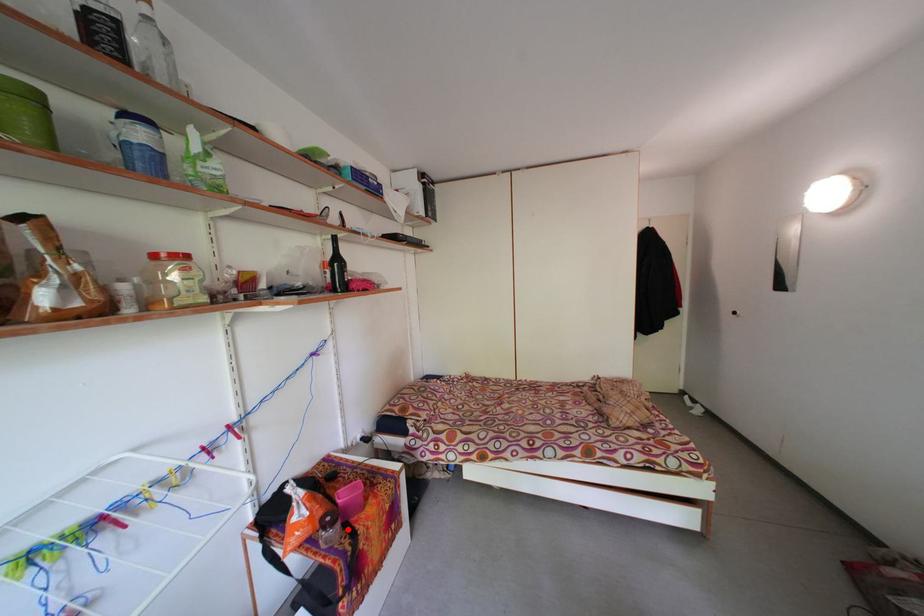
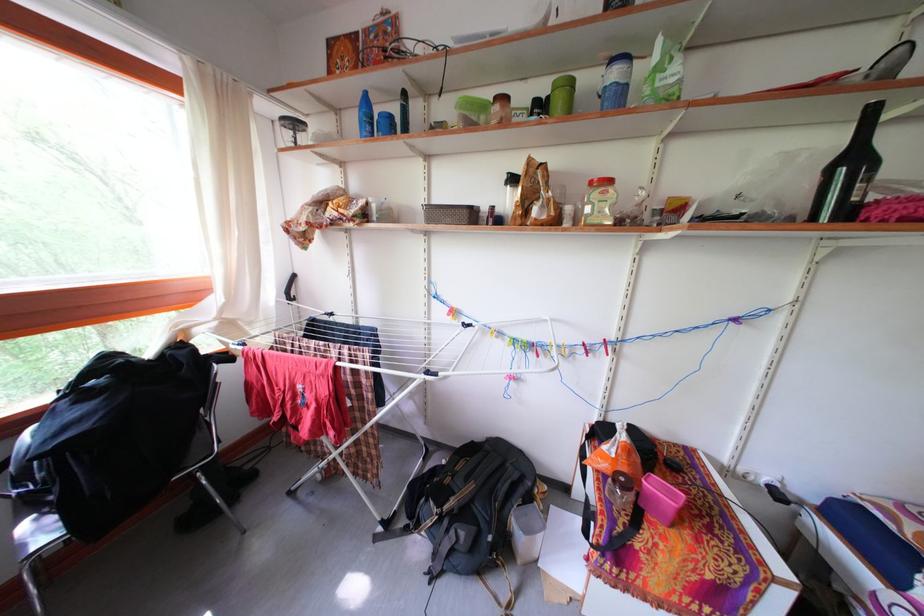
Question: I am providing you with two images of the same scene from different viewpoints. Image1 has a red point marked. In image2, the corresponding 3D location appears at what relative position? Reply with the corresponding letter.

Choices:
 (A) Closer
 (B) Farther

Answer: (B)